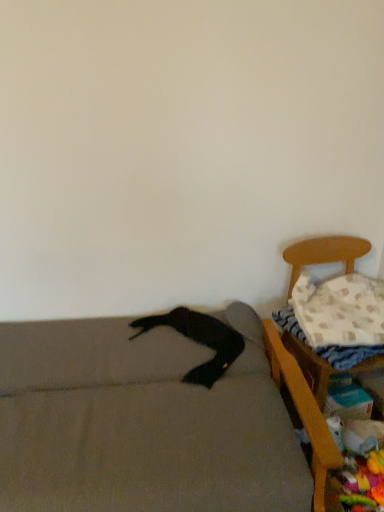
Question: Is white textured blanket at right thinner than soft gray couch at lower left, arranged as the 2th furniture when viewed from the right?

Choices:
 (A) yes
 (B) no

Answer: (A)

Question: Considering the relative sizes of white textured blanket at right and soft gray couch at lower left, arranged as the 2th furniture when viewed from the right, in the image provided, is white textured blanket at right bigger than soft gray couch at lower left, arranged as the 2th furniture when viewed from the right,?

Choices:
 (A) yes
 (B) no

Answer: (B)

Question: Considering the relative sizes of white textured blanket at right and soft gray couch at lower left, which appears as the first furniture when viewed from the left, in the image provided, is white textured blanket at right wider than soft gray couch at lower left, which appears as the first furniture when viewed from the left,?

Choices:
 (A) yes
 (B) no

Answer: (B)

Question: From a real-world perspective, is white textured blanket at right physically below soft gray couch at lower left, arranged as the 2th furniture when viewed from the right?

Choices:
 (A) yes
 (B) no

Answer: (B)

Question: Considering the relative sizes of white textured blanket at right and soft gray couch at lower left, arranged as the 2th furniture when viewed from the right, in the image provided, is white textured blanket at right taller than soft gray couch at lower left, arranged as the 2th furniture when viewed from the right,?

Choices:
 (A) yes
 (B) no

Answer: (B)

Question: From their relative heights in the image, would you say white textured blanket at right is taller or shorter than white textured pillow at right?

Choices:
 (A) tall
 (B) short

Answer: (B)

Question: Based on their positions, is white textured blanket at right located to the left or right of white textured pillow at right?

Choices:
 (A) left
 (B) right

Answer: (A)

Question: From the image's perspective, is white textured blanket at right above or below white textured pillow at right?

Choices:
 (A) above
 (B) below

Answer: (B)

Question: In the image, is white textured blanket at right positioned in front of or behind white textured pillow at right?

Choices:
 (A) behind
 (B) front

Answer: (B)

Question: In terms of width, does black fabric pants at lower left look wider or thinner when compared to soft gray couch at lower left, arranged as the 2th furniture when viewed from the right?

Choices:
 (A) thin
 (B) wide

Answer: (A)

Question: From a real-world perspective, is black fabric pants at lower left physically located above or below soft gray couch at lower left, arranged as the 2th furniture when viewed from the right?

Choices:
 (A) above
 (B) below

Answer: (A)

Question: From the image's perspective, is black fabric pants at lower left above or below soft gray couch at lower left, which appears as the first furniture when viewed from the left?

Choices:
 (A) below
 (B) above

Answer: (B)

Question: Looking at the image, does black fabric pants at lower left seem bigger or smaller compared to soft gray couch at lower left, which appears as the first furniture when viewed from the left?

Choices:
 (A) small
 (B) big

Answer: (A)

Question: From the image's perspective, is wooden chair at right, which is counted as the second furniture, starting from the left, above or below white textured pillow at right?

Choices:
 (A) above
 (B) below

Answer: (B)

Question: Does point (314, 453) appear closer or farther from the camera than point (324, 345)?

Choices:
 (A) farther
 (B) closer

Answer: (B)